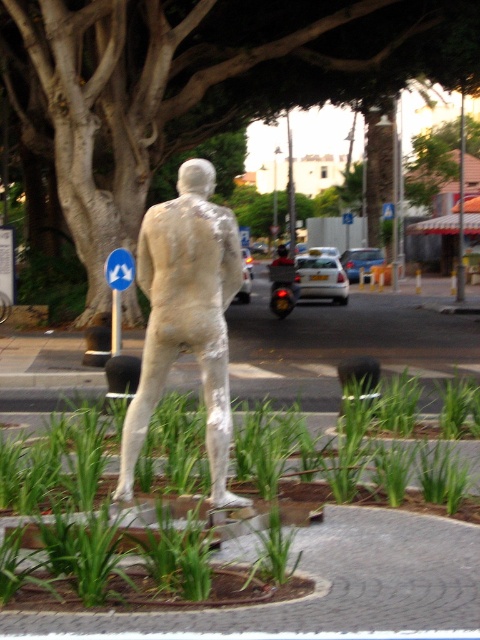
Is green leafy tree at upper center smaller than blue plastic sign at upper left?

Actually, green leafy tree at upper center might be larger than blue plastic sign at upper left.

Which is below, green leafy tree at upper center or blue plastic sign at upper left?

Positioned lower is blue plastic sign at upper left.

The width and height of the screenshot is (480, 640). Find the location of `green leafy tree at upper center`. green leafy tree at upper center is located at coordinates (204, 83).

Does green leafy tree at upper center come behind white plaster figure at center?

Yes, green leafy tree at upper center is further from the viewer.

Between point (439, 45) and point (166, 342), which one is positioned behind?

Positioned behind is point (439, 45).

Between point (106, 116) and point (140, 429), which one is positioned behind?

The point (106, 116) is behind.

The image size is (480, 640). I want to click on green leafy tree at upper center, so click(x=204, y=83).

Is the position of white plaster figure at center more distant than that of blue plastic sign at upper left?

No, white plaster figure at center is closer to the viewer.

Identify the location of white plaster figure at center. (186, 316).

The height and width of the screenshot is (640, 480). Find the location of `white plaster figure at center`. white plaster figure at center is located at coordinates (186, 316).